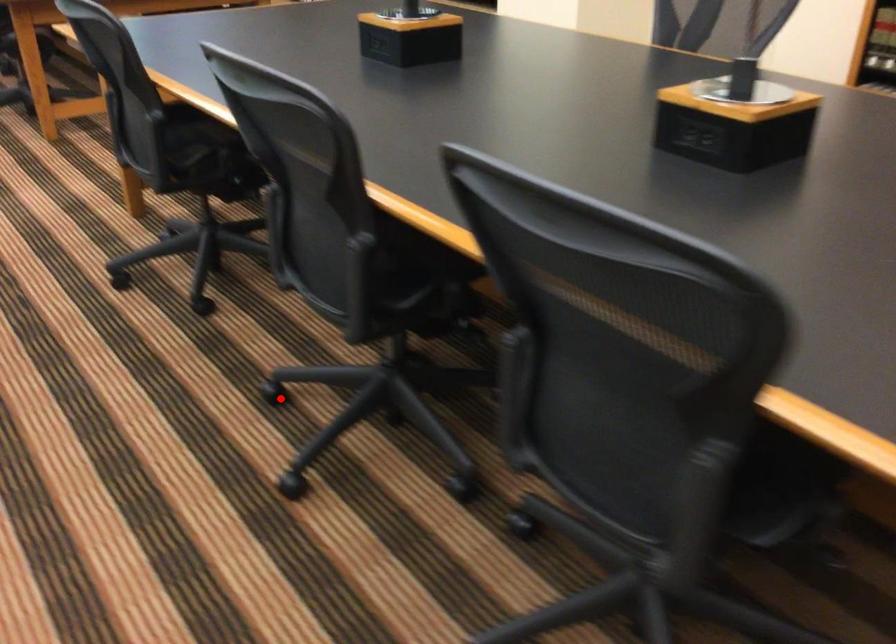
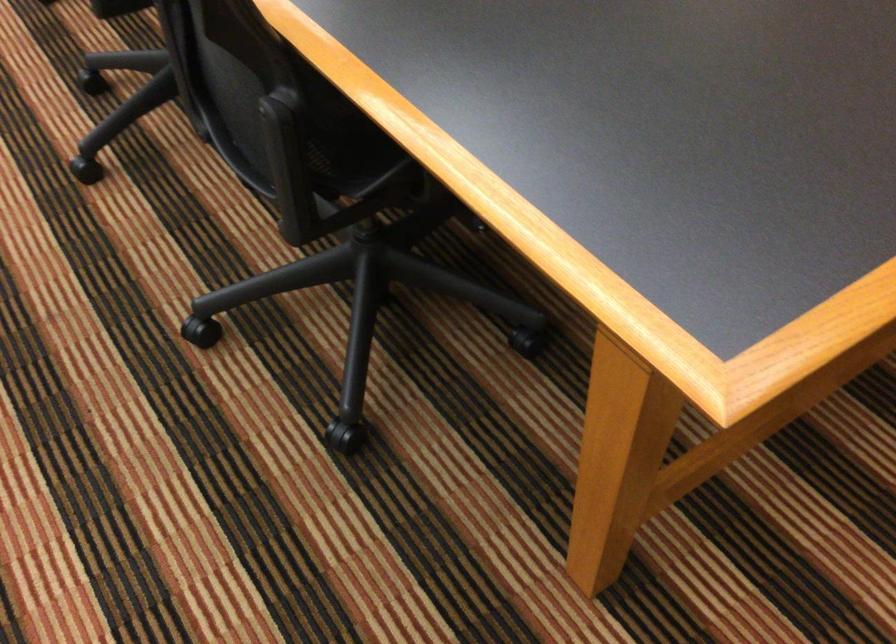
In the second image, find the point that corresponds to the highlighted location in the first image.

(91, 82)